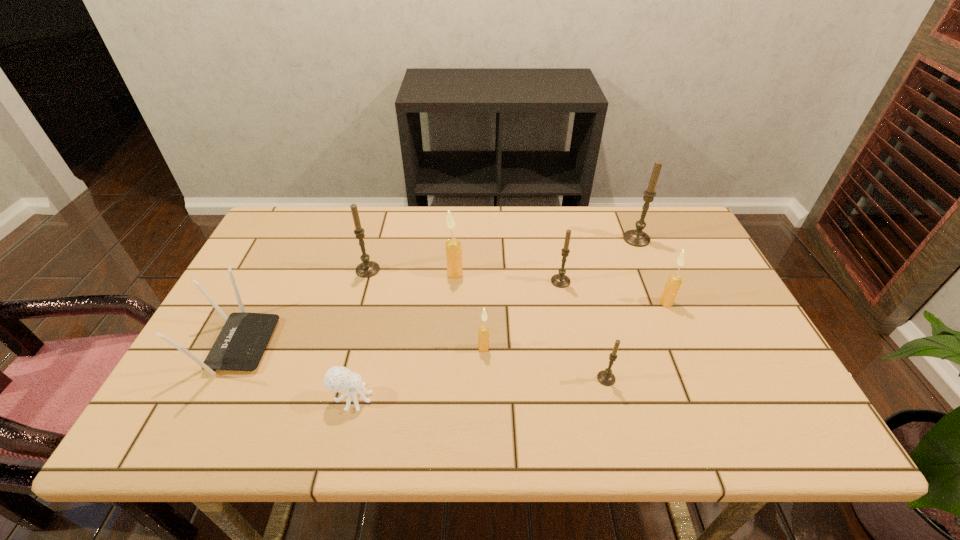
At what (x,y) coordinates should I click in order to perform the action: click on free region located 0.140m on the right of the fifth farthest candle. Please return your answer as a coordinate pair (x, y). The height and width of the screenshot is (540, 960). Looking at the image, I should click on (726, 302).

At what (x,y) coordinates should I click in order to perform the action: click on vacant point located on the front of the sixth object from left to right. Please return your answer as a coordinate pair (x, y). Image resolution: width=960 pixels, height=540 pixels. Looking at the image, I should click on (569, 324).

The image size is (960, 540). I want to click on free space located 0.250m on the front-facing side of the leftmost object, so click(373, 345).

The image size is (960, 540). Identify the location of free space located 0.200m on the right of the nearest gray candle. (704, 379).

In order to click on vacant space positioned 0.080m on the back of the nearest cream candle in this screenshot , I will do `click(484, 319)`.

Identify the location of vacant space located 0.230m on the front-facing side of the white octopus. The width and height of the screenshot is (960, 540). (478, 398).

Identify the location of object that is at the far edge. (638, 238).

At what (x,y) coordinates should I click in order to perform the action: click on object that is at the near edge. Please return your answer as a coordinate pair (x, y). Image resolution: width=960 pixels, height=540 pixels. Looking at the image, I should click on (337, 379).

Where is `object located in the left edge section of the desktop`? The image size is (960, 540). object located in the left edge section of the desktop is located at coordinates (240, 345).

Locate an element on the screen. This screenshot has width=960, height=540. object that is at the far right corner is located at coordinates (638, 238).